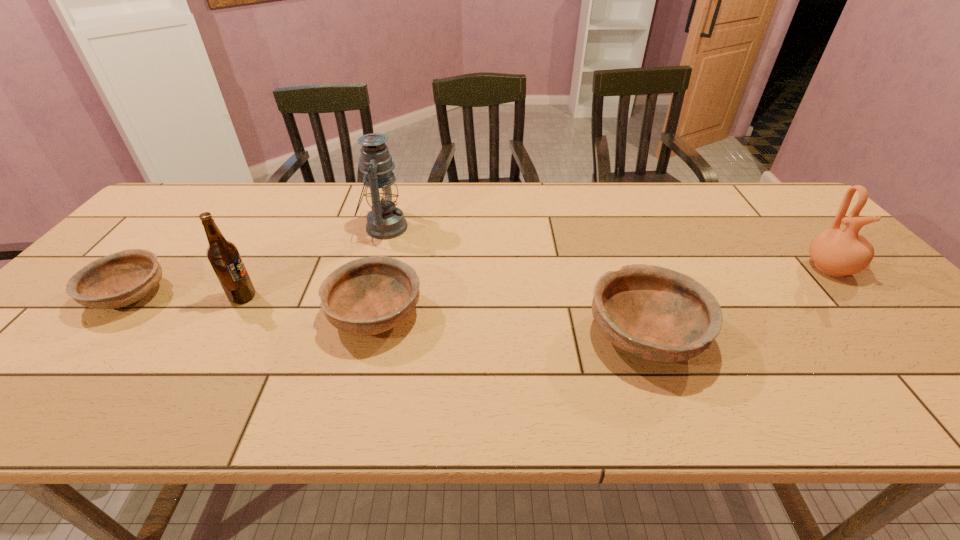
In the current image, all bowls are evenly spaced. To maintain this equal spacing, where should an additional bowl be placed on the right? Please point out a free spot. Please provide its 2D coordinates. Your answer should be formatted as a tuple, i.e. [(x, y)], where the tuple contains the x and y coordinates of a point satisfying the conditions above.

[(943, 357)]